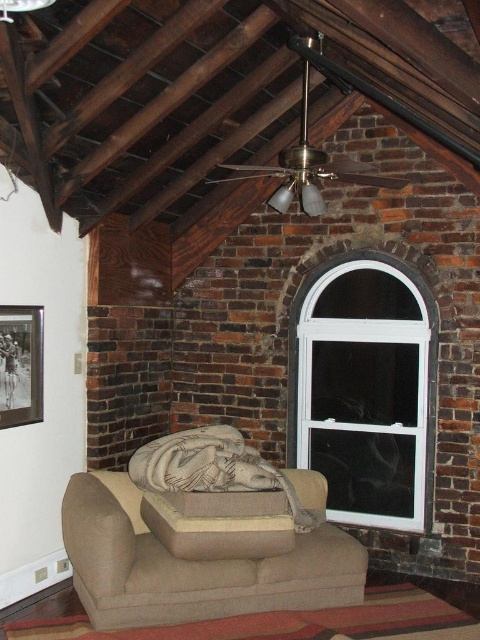
Question: Which point is closer to the camera taking this photo?

Choices:
 (A) (312, 372)
 (B) (316, 528)

Answer: (B)

Question: Is beige fabric couch at center to the right of white plastic window at upper right from the viewer's perspective?

Choices:
 (A) no
 (B) yes

Answer: (A)

Question: Is beige fabric couch at center wider than white plastic window at upper right?

Choices:
 (A) yes
 (B) no

Answer: (A)

Question: Which point is closer to the camera taking this photo?

Choices:
 (A) (99, 627)
 (B) (399, 353)

Answer: (A)

Question: Is beige fabric couch at center thinner than white plastic window at upper right?

Choices:
 (A) yes
 (B) no

Answer: (B)

Question: Which of the following is the farthest from the observer?

Choices:
 (A) beige fabric couch at center
 (B) white plastic window at upper right

Answer: (B)